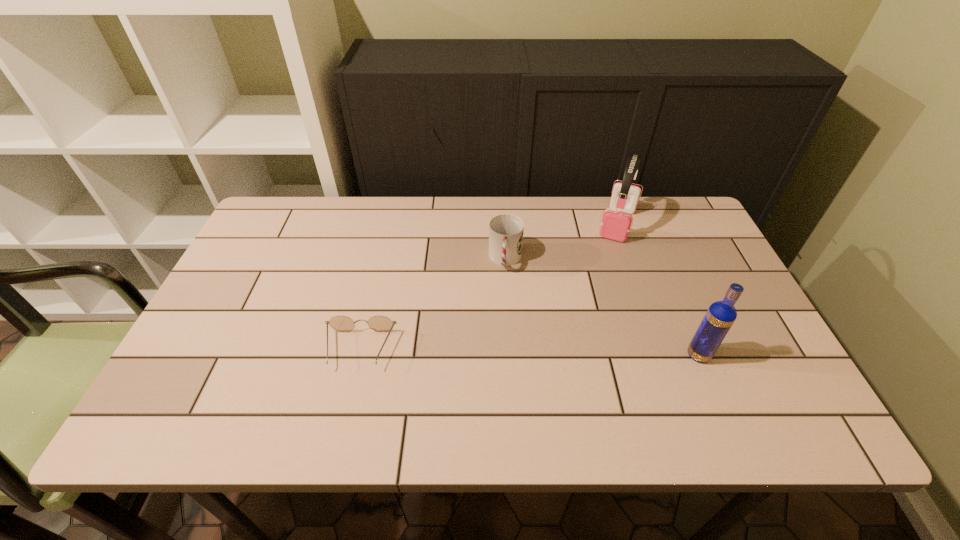
Identify the location of free spot on the desktop that is between the shortest object and the vodka and is positioned on the handle side of the second object from left to right. The height and width of the screenshot is (540, 960). (496, 352).

Locate an element on the screen. The height and width of the screenshot is (540, 960). free space on the desktop that is between the spectacles and the vodka and is positioned on the outer surface of the earphone is located at coordinates (573, 353).